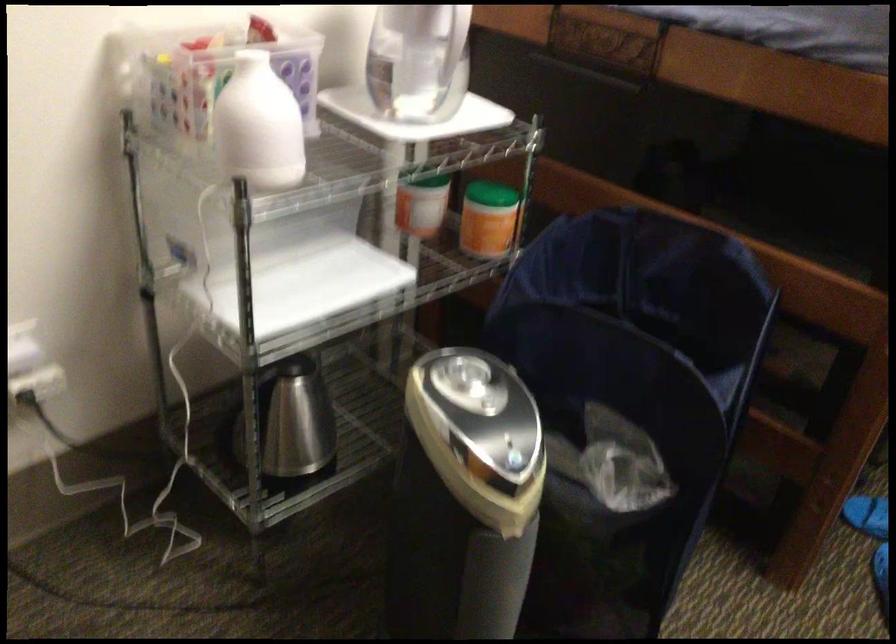
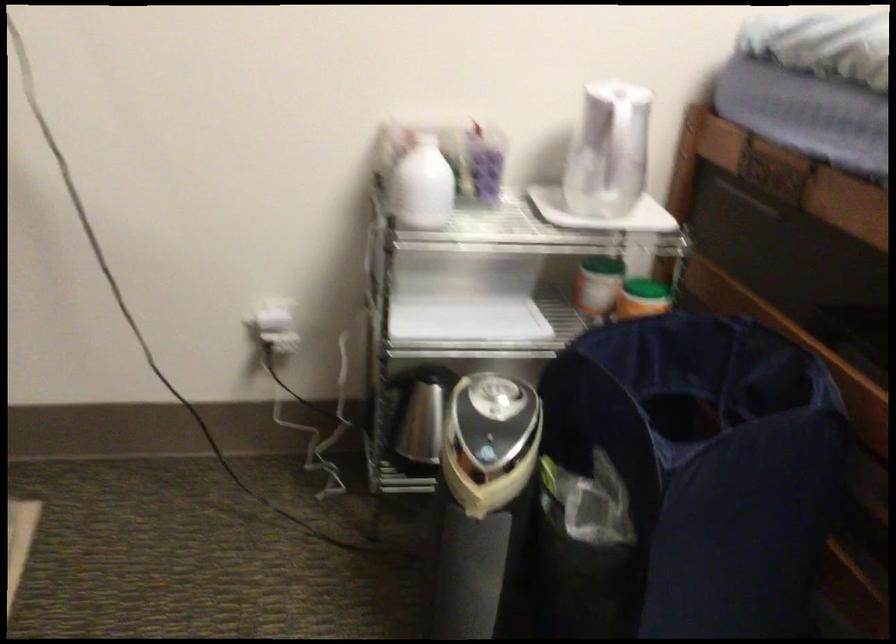
In the second image, find the point that corresponds to point (513, 458) in the first image.

(486, 453)